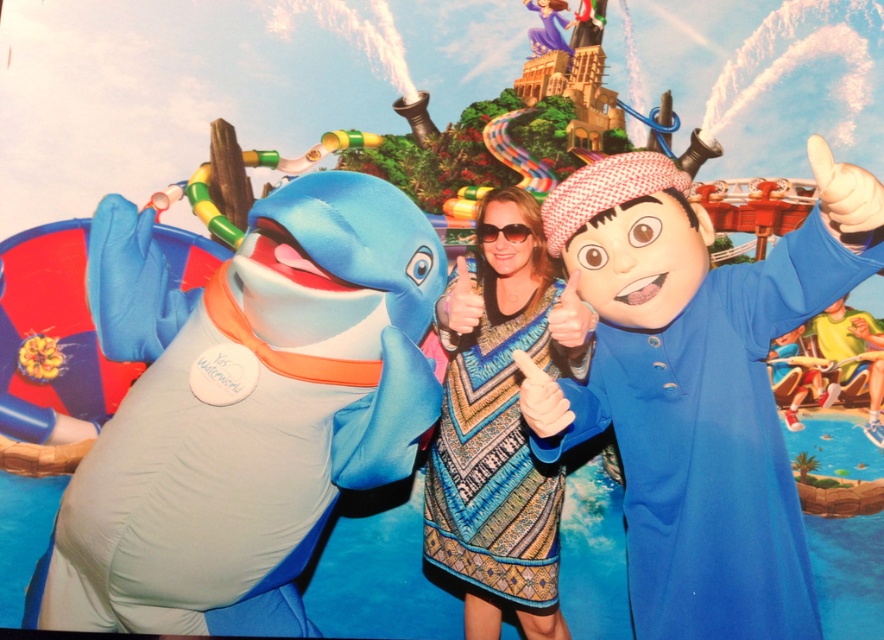
Is point (560, 204) farther from viewer compared to point (494, 600)?

No, (560, 204) is in front of (494, 600).

Is blue matte costume at right to the right of patterned fabric dress at center from the viewer's perspective?

Correct, you'll find blue matte costume at right to the right of patterned fabric dress at center.

Locate an element on the screen. blue matte costume at right is located at coordinates (696, 385).

Identify the location of blue matte costume at right. (696, 385).